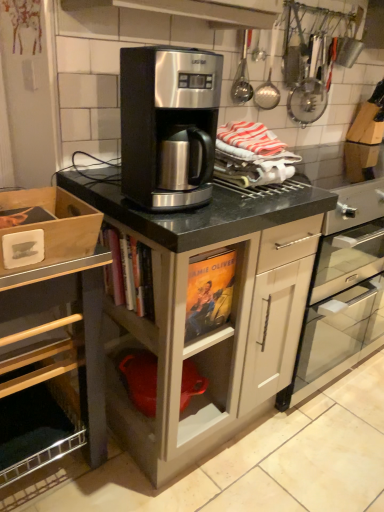
Question: From the image's perspective, is satin black coffee maker at center positioned above or below matte black coffee maker at center, marked as the 1th cabinetry in a right-to-left arrangement?

Choices:
 (A) below
 (B) above

Answer: (B)

Question: Do you think satin black coffee maker at center is within matte black coffee maker at center, which is the second cabinetry from left to right, or outside of it?

Choices:
 (A) inside
 (B) outside

Answer: (B)

Question: Based on their relative distances, which object is farther from the matte black coffee maker at center, which is the second cabinetry from left to right?

Choices:
 (A) stainless steel coffee maker at center
 (B) wooden box at left, placed as the 1th cabinetry when sorted from left to right
 (C) satin black coffee maker at center

Answer: (C)

Question: Which object is the farthest from the matte black coffee maker at center, which is the second cabinetry from left to right?

Choices:
 (A) satin black coffee maker at center
 (B) wooden box at left, placed as the 1th cabinetry when sorted from left to right
 (C) stainless steel coffee maker at center

Answer: (A)